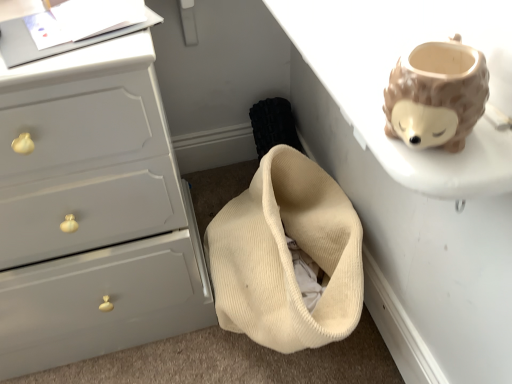
Question: Is matte gray chest of drawers at left wider or thinner than white matte table at upper right?

Choices:
 (A) thin
 (B) wide

Answer: (A)

Question: Is point (156, 240) closer or farther from the camera than point (368, 263)?

Choices:
 (A) closer
 (B) farther

Answer: (A)

Question: Is matte gray chest of drawers at left bigger or smaller than white matte table at upper right?

Choices:
 (A) big
 (B) small

Answer: (A)

Question: Considering the positions of point (377, 276) and point (117, 79), is point (377, 276) closer or farther from the camera than point (117, 79)?

Choices:
 (A) farther
 (B) closer

Answer: (A)

Question: Which is correct: white matte table at upper right is inside matte gray chest of drawers at left, or outside of it?

Choices:
 (A) outside
 (B) inside

Answer: (A)

Question: Looking at their shapes, would you say white matte table at upper right is wider or thinner than matte gray chest of drawers at left?

Choices:
 (A) thin
 (B) wide

Answer: (B)

Question: Is white matte table at upper right bigger or smaller than matte gray chest of drawers at left?

Choices:
 (A) small
 (B) big

Answer: (A)